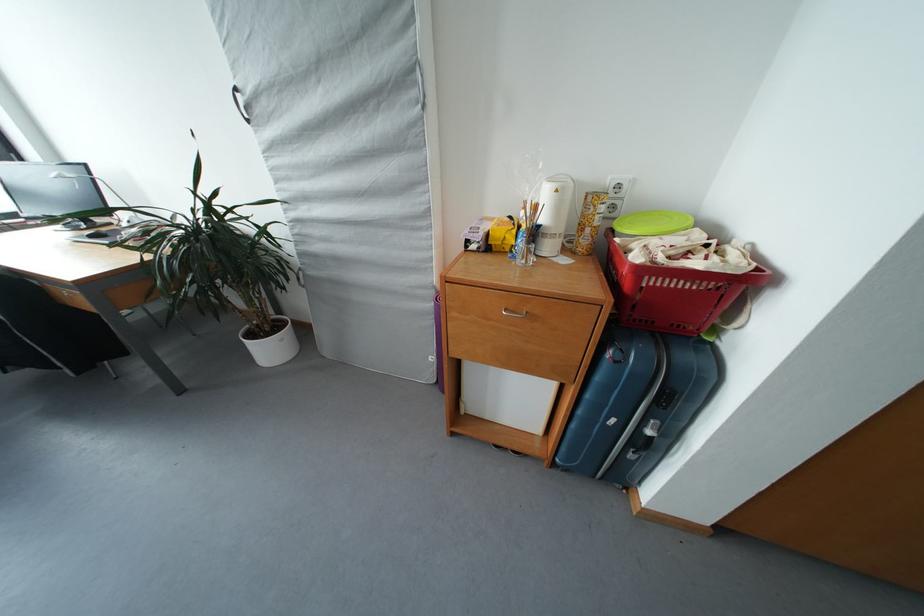
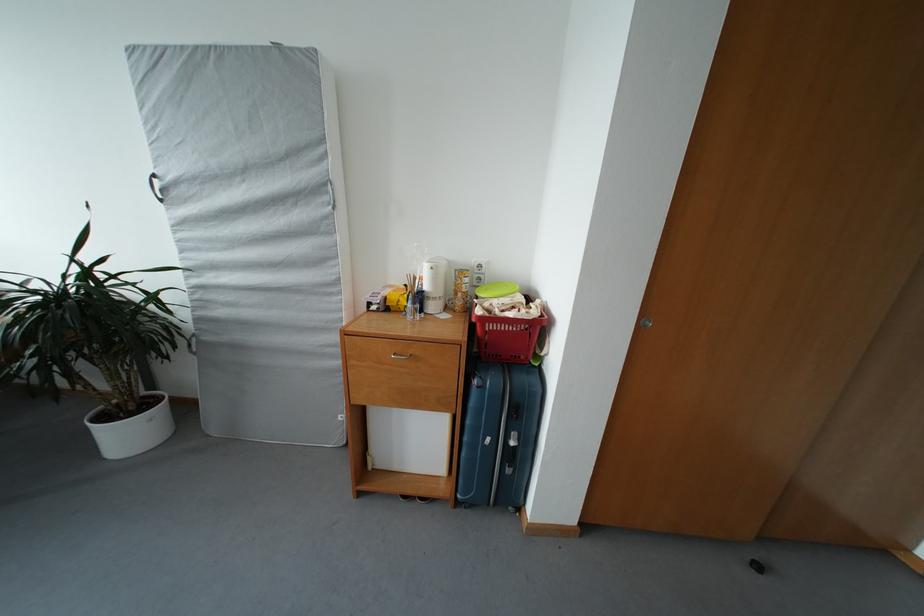
The point at (619,212) is marked in the first image. Where is the corresponding point in the second image?

(485, 284)